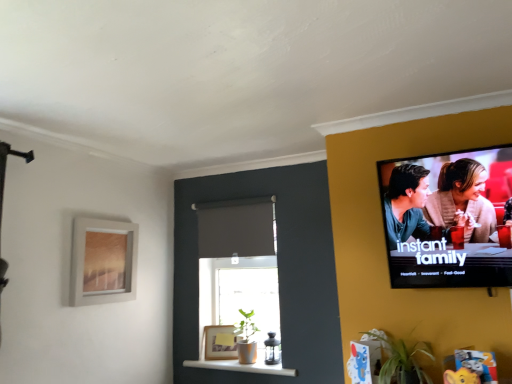
Find the location of a particular element. free point in front of matte gold picture frame at lower center, marked as the 1th picture frame in a back-to-front arrangement is located at coordinates (224, 359).